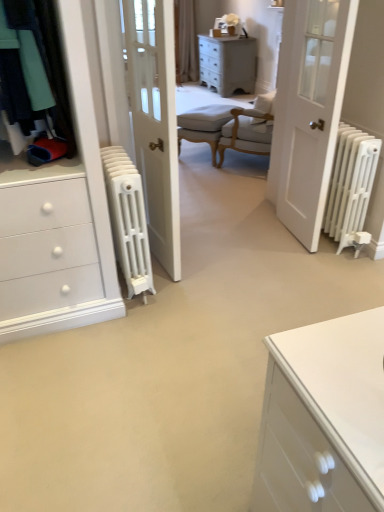
Find the location of a particular element. This screenshot has width=384, height=512. vacant area located to the right-hand side of white matte radiator at left, which is counted as the 1th radiator, starting from the left is located at coordinates coord(198,280).